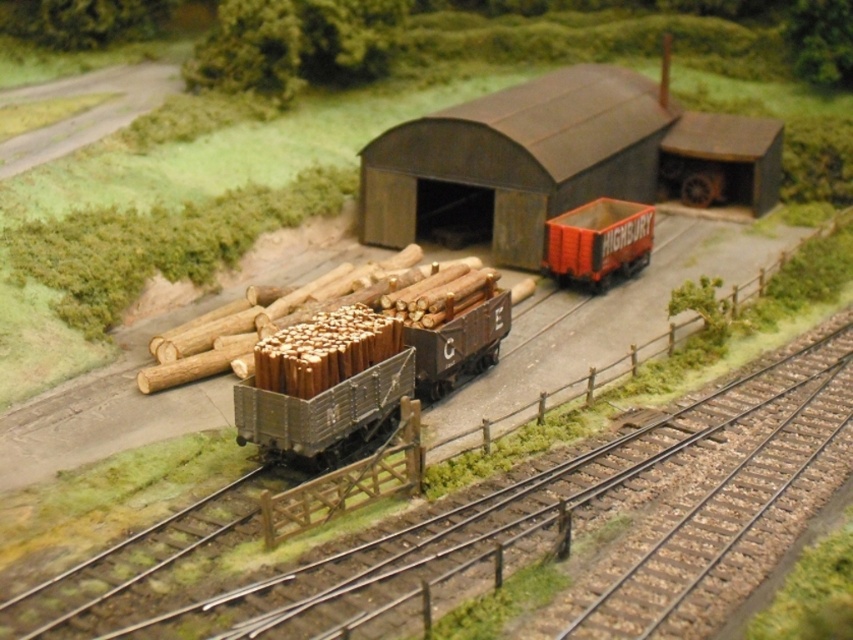
Between metal track at center and dark gray corrugated metal barn at center, which one has more height?

Standing taller between the two is dark gray corrugated metal barn at center.

Does metal track at center come behind dark gray corrugated metal barn at center?

No, it is in front of dark gray corrugated metal barn at center.

Is point (254, 628) closer to viewer compared to point (602, 154)?

Yes, it is.

Locate an element on the screen. This screenshot has width=853, height=640. metal track at center is located at coordinates 436,532.

Between point (415, 129) and point (636, 228), which one is positioned in front?

Point (636, 228) is more forward.

The image size is (853, 640). Describe the element at coordinates (514, 161) in the screenshot. I see `dark gray corrugated metal barn at center` at that location.

Locate an element on the screen. The height and width of the screenshot is (640, 853). dark gray corrugated metal barn at center is located at coordinates (514, 161).

Which of these two, metal track at center or orange plastic truck at center, stands taller?

orange plastic truck at center is taller.

Does metal track at center have a greater width compared to orange plastic truck at center?

Correct, the width of metal track at center exceeds that of orange plastic truck at center.

This screenshot has width=853, height=640. In order to click on metal track at center in this screenshot , I will do `click(436, 532)`.

Locate an element on the screen. metal track at center is located at coordinates tap(436, 532).